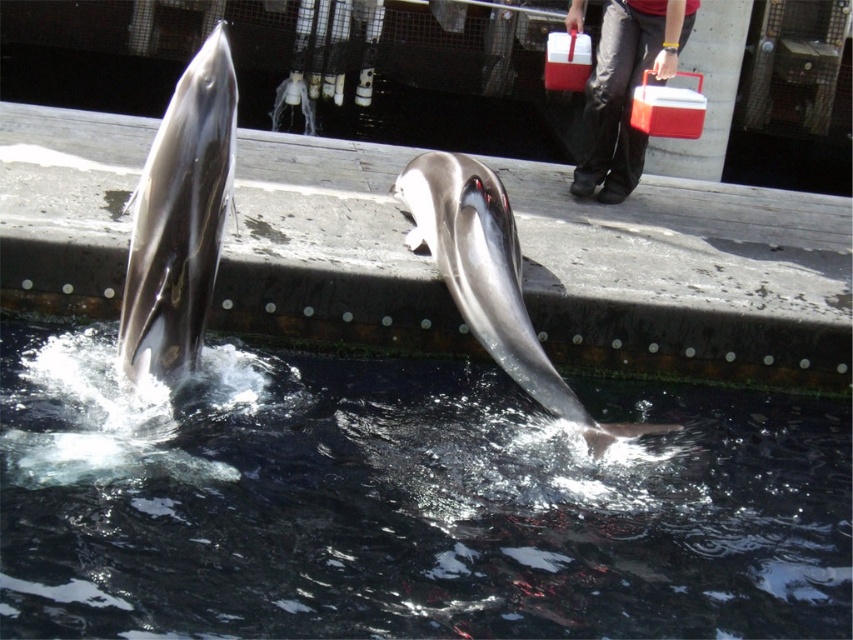
You are a photographer trying to capture a clear shot of the shiny silver dolphin at center without the red plastic cooler at upper right blocking the view. Based on their positions, is this possible?

The shiny silver dolphin at center is positioned under the red plastic cooler at upper right, so the cooler would block the view of the dolphin unless you move your camera angle downward or to the side to avoid the cooler.